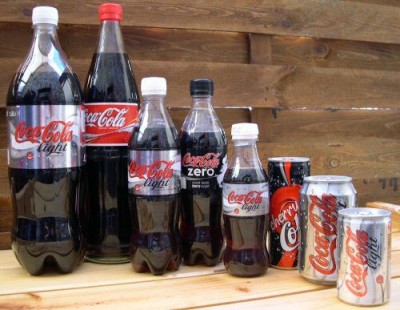
Image resolution: width=400 pixels, height=310 pixels. In order to click on wooden boards in this screenshot , I will do `click(307, 300)`, `click(262, 285)`, `click(83, 276)`, `click(263, 17)`, `click(272, 92)`, `click(254, 51)`, `click(313, 53)`, `click(328, 123)`, `click(348, 161)`, `click(380, 188)`.